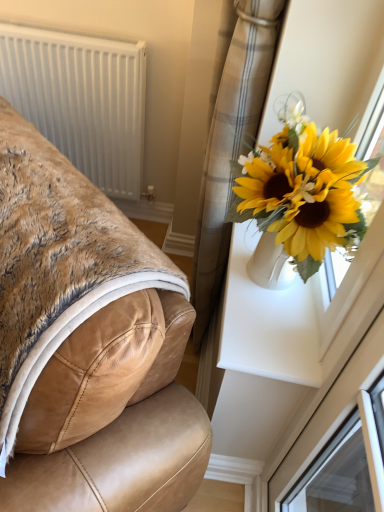
Question: From a real-world perspective, is white plastic radiator at upper left located beneath white plastic window frame at upper right?

Choices:
 (A) no
 (B) yes

Answer: (B)

Question: Is white plastic radiator at upper left oriented away from white plastic window frame at upper right?

Choices:
 (A) no
 (B) yes

Answer: (A)

Question: Is white plastic radiator at upper left to the left of white plastic window frame at upper right from the viewer's perspective?

Choices:
 (A) no
 (B) yes

Answer: (B)

Question: From a real-world perspective, is white plastic radiator at upper left on white plastic window frame at upper right?

Choices:
 (A) yes
 (B) no

Answer: (B)

Question: Can you confirm if white plastic radiator at upper left is positioned to the right of white plastic window frame at upper right?

Choices:
 (A) no
 (B) yes

Answer: (A)

Question: Is white plastic radiator at upper left shorter than white plastic window frame at upper right?

Choices:
 (A) no
 (B) yes

Answer: (A)

Question: Considering the relative positions of plaid fabric curtain at upper right and tan leather chair at left in the image provided, is plaid fabric curtain at upper right to the right of tan leather chair at left from the viewer's perspective?

Choices:
 (A) no
 (B) yes

Answer: (B)

Question: Is plaid fabric curtain at upper right positioned far away from tan leather chair at left?

Choices:
 (A) no
 (B) yes

Answer: (A)

Question: Considering the relative sizes of plaid fabric curtain at upper right and tan leather chair at left in the image provided, is plaid fabric curtain at upper right bigger than tan leather chair at left?

Choices:
 (A) yes
 (B) no

Answer: (B)

Question: Does plaid fabric curtain at upper right lie in front of tan leather chair at left?

Choices:
 (A) yes
 (B) no

Answer: (B)

Question: From a real-world perspective, is plaid fabric curtain at upper right beneath tan leather chair at left?

Choices:
 (A) no
 (B) yes

Answer: (A)

Question: Is plaid fabric curtain at upper right to the left of tan leather chair at left from the viewer's perspective?

Choices:
 (A) no
 (B) yes

Answer: (A)

Question: Considering the relative sizes of tan leather chair at left and white plastic radiator at upper left in the image provided, is tan leather chair at left bigger than white plastic radiator at upper left?

Choices:
 (A) no
 (B) yes

Answer: (B)